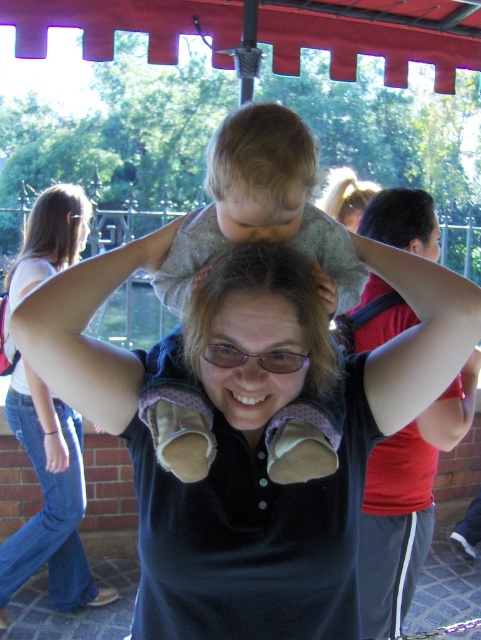
Question: Which point is closer to the camera?

Choices:
 (A) (403, 227)
 (B) (42, 412)

Answer: (A)

Question: Which of the following is the closest to the observer?

Choices:
 (A) (279, 257)
 (B) (35, 360)
 (C) (29, 532)
 (D) (242, 124)

Answer: (A)

Question: Estimate the real-world distances between objects in this image. Which object is farther from the blonde hair at upper left?

Choices:
 (A) blonde hair at center
 (B) matte black shirt at center
 (C) light gray fabric baby at center

Answer: (C)

Question: Can you confirm if matte black hair at center is positioned below blonde hair at upper left?

Choices:
 (A) no
 (B) yes

Answer: (B)

Question: Is light gray fabric baby at center to the left of matte black arm at upper center from the viewer's perspective?

Choices:
 (A) no
 (B) yes

Answer: (A)

Question: Is matte black shirt at center thinner than matte black arm at upper center?

Choices:
 (A) yes
 (B) no

Answer: (B)